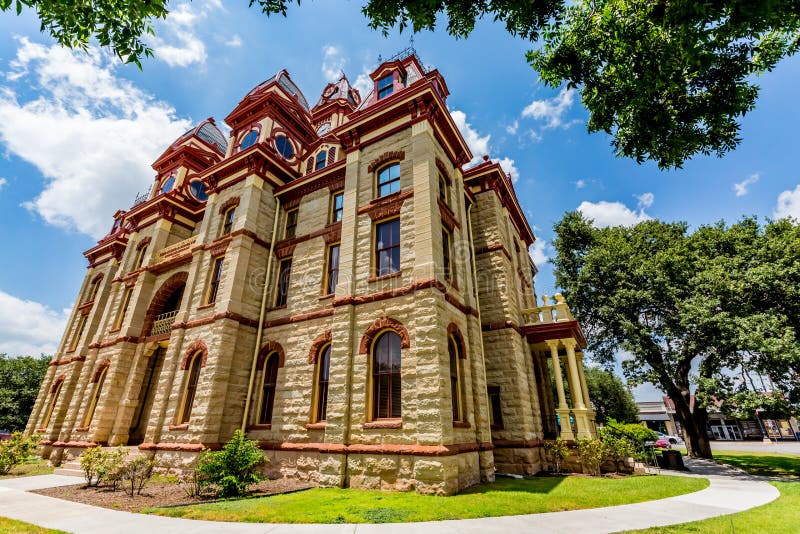
This screenshot has height=534, width=800. I want to click on door, so click(x=716, y=430), click(x=738, y=430), click(x=146, y=415).